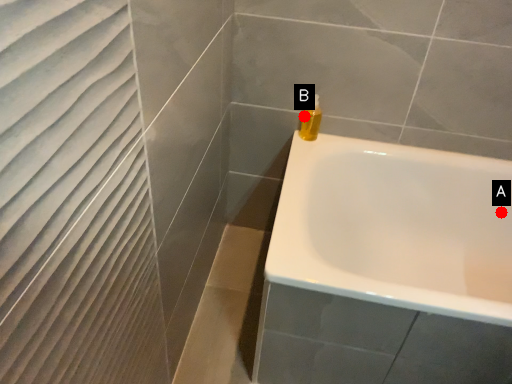
Question: Two points are circled on the image, labeled by A and B beside each circle. Among these points, which one is nearest to the camera?

Choices:
 (A) A is closer
 (B) B is closer

Answer: (B)